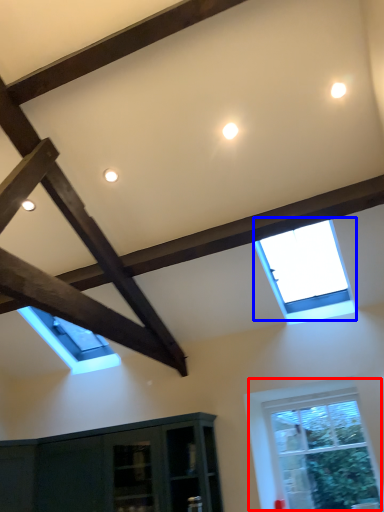
Question: Which object appears closest to the camera in this image, window (highlighted by a red box) or window (highlighted by a blue box)?

Choices:
 (A) window
 (B) window

Answer: (B)